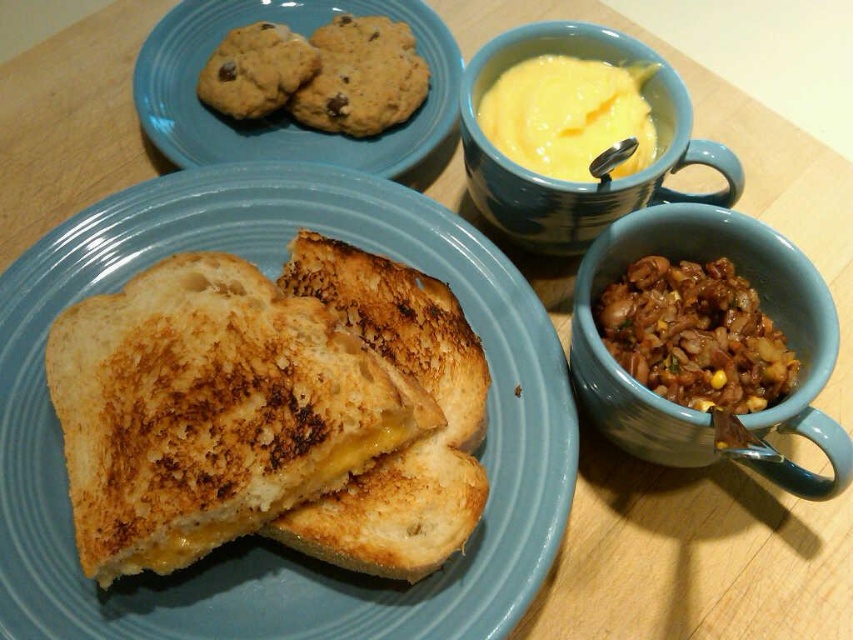
Can you confirm if golden brown toasted bread at center is positioned to the right of brown matte mug at center-right?

No, golden brown toasted bread at center is not to the right of brown matte mug at center-right.

Is golden brown toasted bread at center closer to the viewer compared to brown matte mug at center-right?

Yes, it is in front of brown matte mug at center-right.

Who is more forward, (148,276) or (596,275)?

Point (596,275) is in front.

You are a GUI agent. You are given a task and a screenshot of the screen. Output one action in this format:
    pyautogui.click(x=<x>, y=<y>)
    Task: Click on the golden brown toasted bread at center
    
    Given the screenshot: What is the action you would take?
    (212, 410)

Where is `golden brown toasted bread at center`? The width and height of the screenshot is (853, 640). golden brown toasted bread at center is located at coordinates (212, 410).

Who is positioned more to the left, golden brown toasted bread at center or brown matte rice at lower right?

golden brown toasted bread at center

Is point (94, 384) positioned in front of point (682, 403)?

No, it is not.

Find the location of a particular element. This screenshot has width=853, height=640. golden brown toasted bread at center is located at coordinates (212, 410).

Who is taller, matte ceramic plate at center or brown matte rice at lower right?

matte ceramic plate at center is taller.

Which is more to the right, matte ceramic plate at center or brown matte rice at lower right?

brown matte rice at lower right

Is point (196, 214) closer to viewer compared to point (720, 337)?

No, it is not.

Identify the location of matte ceramic plate at center. This screenshot has height=640, width=853. (260, 540).